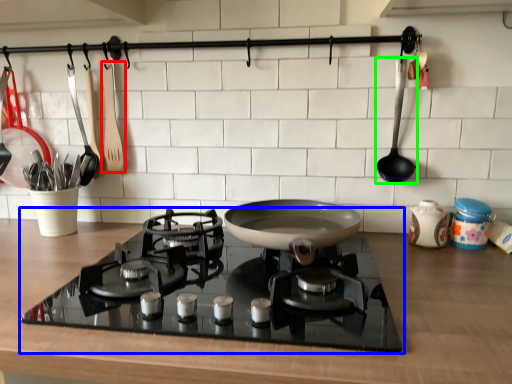
Question: Which is nearer to the kitchen appliance (highlighted by a red box)? gas stove (highlighted by a blue box) or spoon (highlighted by a green box).

Choices:
 (A) gas stove
 (B) spoon

Answer: (A)